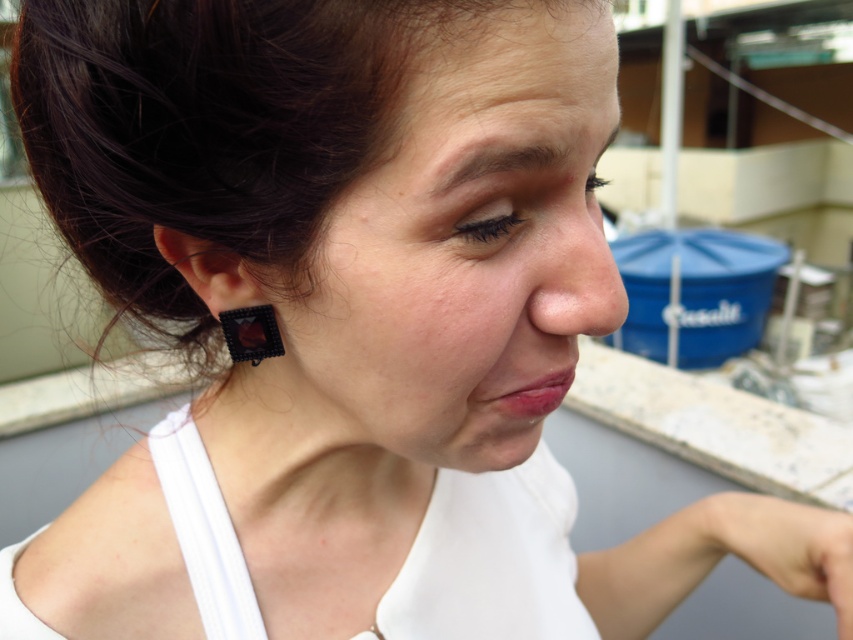
Does black beaded earring at ear appear on the left side of smooth skin nose at center?

Correct, you'll find black beaded earring at ear to the left of smooth skin nose at center.

Who is lower down, black beaded earring at ear or smooth skin nose at center?

Positioned lower is black beaded earring at ear.

Image resolution: width=853 pixels, height=640 pixels. What are the coordinates of `black beaded earring at ear` in the screenshot? It's located at (251, 333).

Is dark brown hair at upper center taller than black beaded earring at ear?

In fact, dark brown hair at upper center may be shorter than black beaded earring at ear.

This screenshot has height=640, width=853. What do you see at coordinates (498, 160) in the screenshot?
I see `dark brown hair at upper center` at bounding box center [498, 160].

Locate an element on the screen. The image size is (853, 640). dark brown hair at upper center is located at coordinates (498, 160).

Who is shorter, dark brown hair at upper center or smooth skin nose at center?

dark brown hair at upper center

What do you see at coordinates (498, 160) in the screenshot?
I see `dark brown hair at upper center` at bounding box center [498, 160].

Is point (515, 168) farther from camera compared to point (616, 339)?

That is False.

The width and height of the screenshot is (853, 640). In order to click on dark brown hair at upper center in this screenshot , I will do `click(498, 160)`.